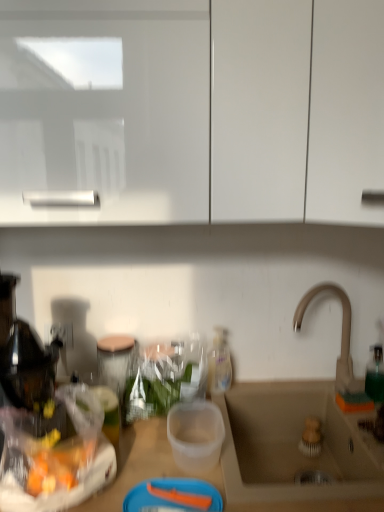
This screenshot has height=512, width=384. Find the location of `beige ceramic sink at lower right`. beige ceramic sink at lower right is located at coordinates [296, 433].

What do you see at coordinates (191, 111) in the screenshot? Image resolution: width=384 pixels, height=512 pixels. I see `white glossy cabinet at upper center` at bounding box center [191, 111].

At what (x,y) coordinates should I click in order to perform the action: click on translucent plastic bottle at center. Please return your answer as a coordinate pair (x, y). The height and width of the screenshot is (512, 384). Looking at the image, I should click on (219, 362).

Can you confirm if beige ceramic sink at lower right is taller than white glossy cabinet at upper center?

Incorrect, the height of beige ceramic sink at lower right is not larger of that of white glossy cabinet at upper center.

Which is in front, point (259, 481) or point (65, 12)?

The point (65, 12) is closer to the camera.

Where is `sink below the white glossy cabinet at upper center (from a real-world perspective)`? The height and width of the screenshot is (512, 384). sink below the white glossy cabinet at upper center (from a real-world perspective) is located at coordinates click(296, 433).

Which is more to the left, beige ceramic sink at lower right or white glossy cabinet at upper center?

white glossy cabinet at upper center.

From the picture: Can you tell me how much translucent plastic bottle at center and beige ceramic sink at lower right differ in facing direction?

0.648 degrees.

From their relative heights in the image, would you say translucent plastic bottle at center is taller or shorter than beige ceramic sink at lower right?

Clearly, translucent plastic bottle at center is taller compared to beige ceramic sink at lower right.

Considering the sizes of translucent plastic bottle at center and beige ceramic sink at lower right in the image, is translucent plastic bottle at center bigger or smaller than beige ceramic sink at lower right?

In the image, translucent plastic bottle at center appears to be smaller than beige ceramic sink at lower right.

Is point (347, 360) behind point (223, 357)?

No, (347, 360) is closer to viewer.

In the image, is beige ceramic sink at lower right positioned in front of or behind translucent plastic bottle at center?

beige ceramic sink at lower right is in front of translucent plastic bottle at center.

Is beige ceramic sink at lower right far away from translucent plastic bottle at center?

No, beige ceramic sink at lower right is not far from translucent plastic bottle at center.

Is beige ceramic sink at lower right oriented away from translucent plastic bottle at center?

That's not correct — beige ceramic sink at lower right is not looking away from translucent plastic bottle at center.

From the image's perspective, is satin nickel faucet at sink right positioned above or below beige ceramic sink at lower right?

→ satin nickel faucet at sink right is above beige ceramic sink at lower right.

Can you confirm if satin nickel faucet at sink right is positioned to the right of beige ceramic sink at lower right?

Correct, you'll find satin nickel faucet at sink right to the right of beige ceramic sink at lower right.

From a real-world perspective, is satin nickel faucet at sink right under beige ceramic sink at lower right?

Incorrect, from a real-world perspective, satin nickel faucet at sink right is higher than beige ceramic sink at lower right.

Is satin nickel faucet at sink right oriented away from beige ceramic sink at lower right?

No, satin nickel faucet at sink right is not facing away from beige ceramic sink at lower right.

Can you tell me how much satin nickel faucet at sink right and translucent plastic bottle at center differ in facing direction?

There is a 0.379-degree angle between the facing directions of satin nickel faucet at sink right and translucent plastic bottle at center.

From a real-world perspective, is satin nickel faucet at sink right physically located above or below translucent plastic bottle at center?

Clearly, from a real-world perspective, satin nickel faucet at sink right is above translucent plastic bottle at center.

From the image's perspective, which object appears higher, satin nickel faucet at sink right or translucent plastic bottle at center?

satin nickel faucet at sink right, from the image's perspective.

Is point (344, 304) closer to camera compared to point (224, 334)?

Yes.

From the picture: Which is correct: satin nickel faucet at sink right is inside white glossy cabinet at upper center, or outside of it?

satin nickel faucet at sink right is located beyond the bounds of white glossy cabinet at upper center.

Where is `tap lying behind the white glossy cabinet at upper center`? The image size is (384, 512). tap lying behind the white glossy cabinet at upper center is located at coordinates (342, 333).

Is satin nickel faucet at sink right smaller than white glossy cabinet at upper center?

Indeed, satin nickel faucet at sink right has a smaller size compared to white glossy cabinet at upper center.

Consider the image. Is translucent plastic bottle at center shorter than white glossy cabinet at upper center?

Yes, translucent plastic bottle at center is shorter than white glossy cabinet at upper center.

The height and width of the screenshot is (512, 384). In order to click on bottle lying on the right of white glossy cabinet at upper center in this screenshot , I will do `click(219, 362)`.

From the image's perspective, is translucent plastic bottle at center above or below white glossy cabinet at upper center?

Clearly, from the image's perspective, translucent plastic bottle at center is below white glossy cabinet at upper center.

Considering the relative sizes of translucent plastic bottle at center and white glossy cabinet at upper center in the image provided, is translucent plastic bottle at center smaller than white glossy cabinet at upper center?

Correct, translucent plastic bottle at center occupies less space than white glossy cabinet at upper center.

You are a GUI agent. You are given a task and a screenshot of the screen. Output one action in this format:
    pyautogui.click(x=<x>, y=<y>)
    Task: Click on the sink that appears on the right of white glossy cabinet at upper center
    
    Given the screenshot: What is the action you would take?
    pyautogui.click(x=296, y=433)

In order to click on sink below the translucent plastic bottle at center (from the image's perspective) in this screenshot , I will do `click(296, 433)`.

Estimate the real-world distances between objects in this image. Which object is closer to satin nickel faucet at sink right, beige ceramic sink at lower right or translucent plastic bottle at center?

Among the two, beige ceramic sink at lower right is located nearer to satin nickel faucet at sink right.

From the image, which object appears to be farther from translucent plastic bottle at center, beige ceramic sink at lower right or satin nickel faucet at sink right?

Among the two, satin nickel faucet at sink right is located further to translucent plastic bottle at center.

From the image, which object appears to be farther from translucent plastic bottle at center, beige ceramic sink at lower right or white glossy cabinet at upper center?

white glossy cabinet at upper center is positioned further to the anchor translucent plastic bottle at center.

Estimate the real-world distances between objects in this image. Which object is further from satin nickel faucet at sink right, white glossy cabinet at upper center or beige ceramic sink at lower right?

white glossy cabinet at upper center is positioned further to the anchor satin nickel faucet at sink right.

Based on their spatial positions, is beige ceramic sink at lower right or translucent plastic bottle at center closer to white glossy cabinet at upper center?

beige ceramic sink at lower right lies closer to white glossy cabinet at upper center than the other object.

When comparing their distances from beige ceramic sink at lower right, does white glossy cabinet at upper center or translucent plastic bottle at center seem further?

The object further to beige ceramic sink at lower right is white glossy cabinet at upper center.

In the scene shown: Based on their spatial positions, is translucent plastic bottle at center or white glossy cabinet at upper center further from satin nickel faucet at sink right?

The object further to satin nickel faucet at sink right is white glossy cabinet at upper center.

When comparing their distances from white glossy cabinet at upper center, does beige ceramic sink at lower right or satin nickel faucet at sink right seem closer?

beige ceramic sink at lower right lies closer to white glossy cabinet at upper center than the other object.

The width and height of the screenshot is (384, 512). I want to click on tap positioned between beige ceramic sink at lower right and translucent plastic bottle at center from near to far, so click(x=342, y=333).

Where is `tap between white glossy cabinet at upper center and translucent plastic bottle at center in the up-down direction`? The width and height of the screenshot is (384, 512). tap between white glossy cabinet at upper center and translucent plastic bottle at center in the up-down direction is located at coordinates (342, 333).

What are the coordinates of `bottle between white glossy cabinet at upper center and beige ceramic sink at lower right from top to bottom` in the screenshot? It's located at (219, 362).

At what (x,y) coordinates should I click in order to perform the action: click on tap that lies between white glossy cabinet at upper center and beige ceramic sink at lower right from top to bottom. Please return your answer as a coordinate pair (x, y). Looking at the image, I should click on (342, 333).